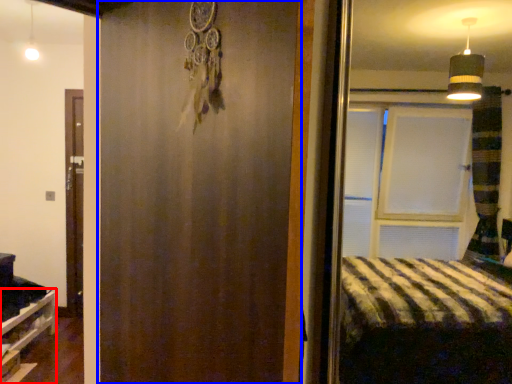
Question: Which object is closer to the camera taking this photo, shelf (highlighted by a red box) or barn door (highlighted by a blue box)?

Choices:
 (A) shelf
 (B) barn door

Answer: (B)